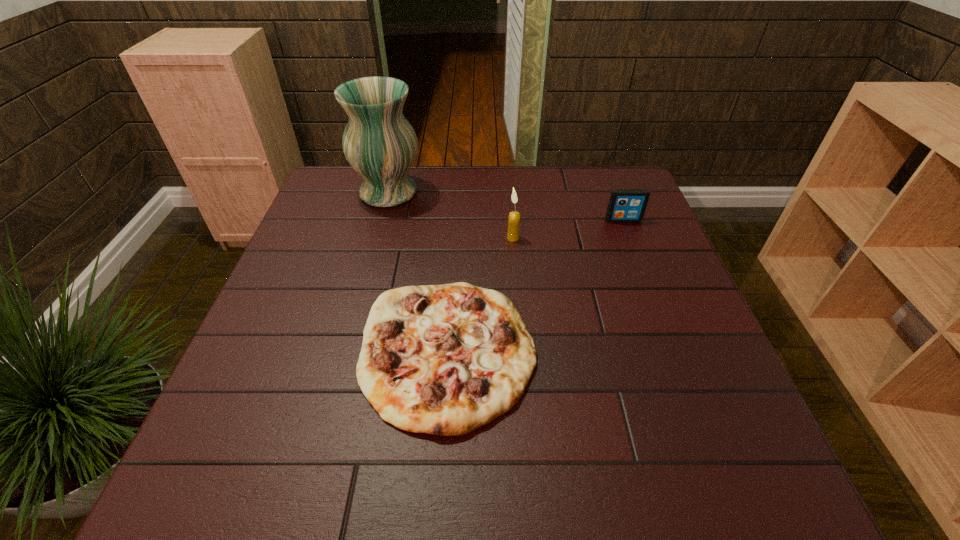
Identify the location of free space at the far left corner. This screenshot has width=960, height=540. (356, 180).

Locate an element on the screen. This screenshot has width=960, height=540. blank space at the far right corner is located at coordinates (613, 169).

At what (x,y) coordinates should I click in order to perform the action: click on vacant region at the near right corner of the desktop. Please return your answer as a coordinate pair (x, y). This screenshot has width=960, height=540. Looking at the image, I should click on (755, 454).

Find the location of a particular element. The width and height of the screenshot is (960, 540). free space between the third farthest object and the second farthest object is located at coordinates (568, 229).

Where is `empty space between the shortest object and the tallest object`? Image resolution: width=960 pixels, height=540 pixels. empty space between the shortest object and the tallest object is located at coordinates (419, 272).

Where is `vacant area that lies between the candle and the vase`? vacant area that lies between the candle and the vase is located at coordinates coord(450,215).

Locate an element on the screen. This screenshot has height=540, width=960. free point between the rightmost object and the third farthest object is located at coordinates (568, 229).

This screenshot has width=960, height=540. Find the location of `empty space that is in between the pizza and the iPod`. empty space that is in between the pizza and the iPod is located at coordinates (536, 286).

Where is `vacant area between the second tallest object and the rightmost object`? This screenshot has height=540, width=960. vacant area between the second tallest object and the rightmost object is located at coordinates (568, 229).

Identify the location of the closest object to the rightmost object. (514, 217).